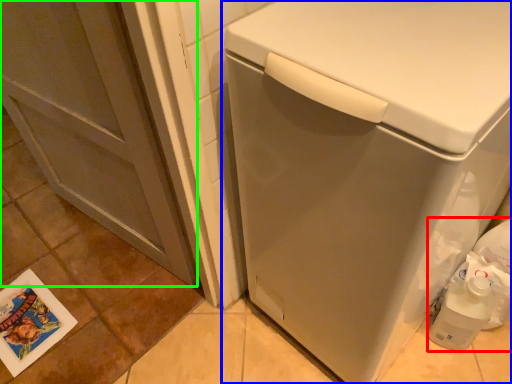
Question: Which object is positioned farthest from garbage (highlighted by a red box)? Select from washing machine (highlighted by a blue box) and screen door (highlighted by a green box).

Choices:
 (A) washing machine
 (B) screen door

Answer: (B)